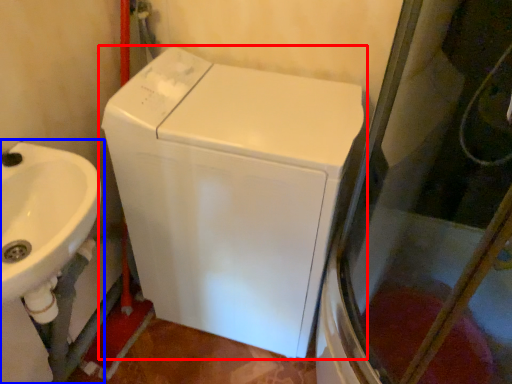
Question: Which object is closer to the camera taking this photo, washing machine (highlighted by a red box) or sink (highlighted by a blue box)?

Choices:
 (A) washing machine
 (B) sink

Answer: (B)